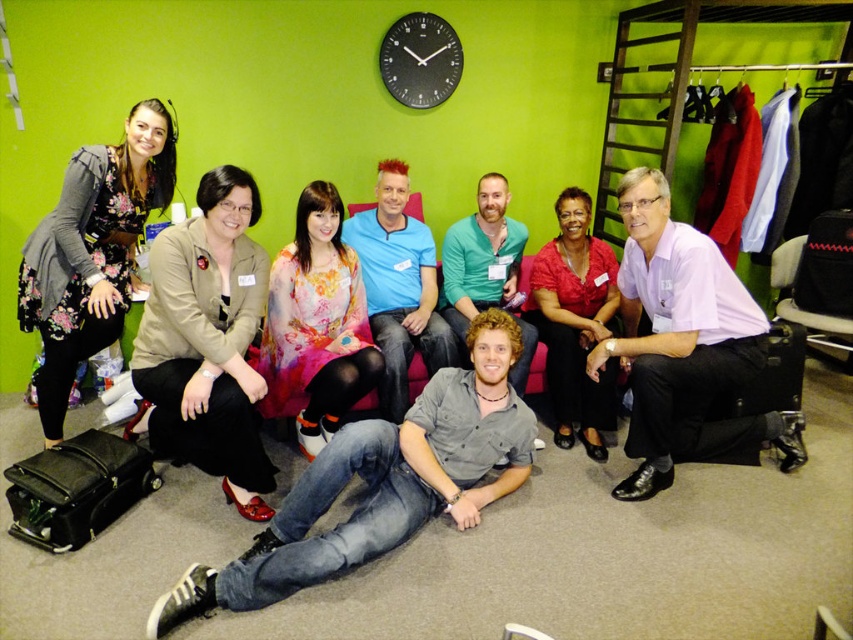
You are a photographer setting up for a group photo. You notice the floral dress at left and the matte red blouse at center. Which clothing item is positioned closer to the camera?

The floral dress at left is closer to the viewer than the matte red blouse at center, so the floral dress at left is positioned closer to the camera.

You are a photographer setting up for a group photo. You notice the jeans at center and the matte red blouse at center in the scene. Based on their positions, which clothing item is closer to the floor?

The jeans at center is located below matte red blouse at center, so the jeans at center is closer to the floor.

From the picture: You are a photographer setting up for a group photo. You have a wide camera lens that can capture objects up to 1.5 meters in width. You see the floral dress at left and the teal matte shirt at center. Can both fit within the lens width if they are positioned side by side?

The floral dress at left might be wider than teal matte shirt at center, so the total width of both items together may exceed 1.5 meters. It depends on their exact widths, but there is a possibility they won t fit.